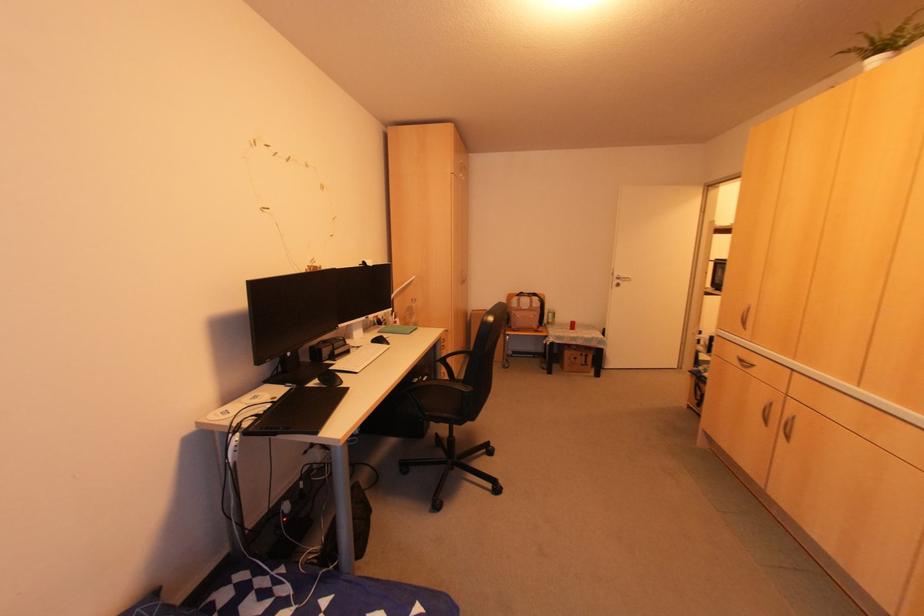
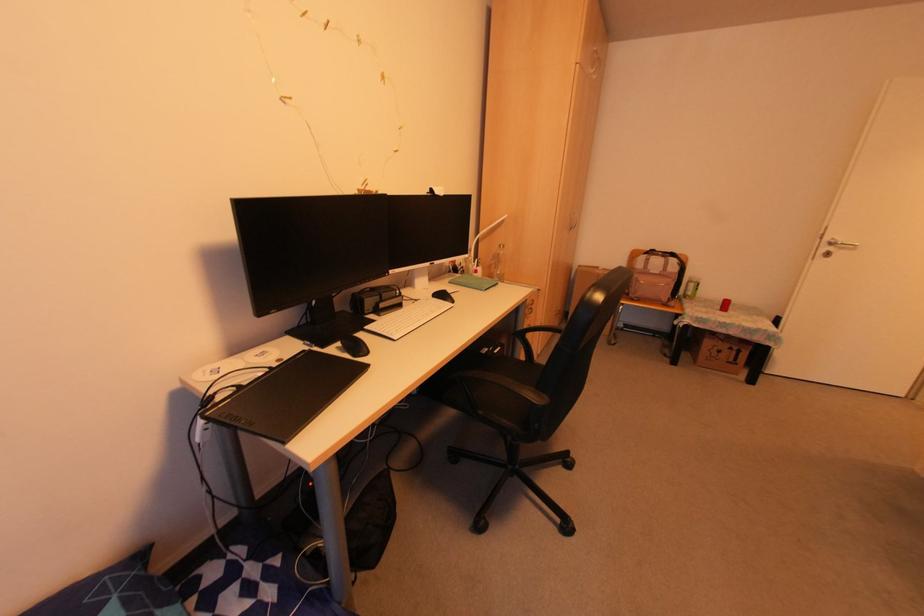
In the second image, find the point that corresponds to [286,158] in the first image.

(324, 22)